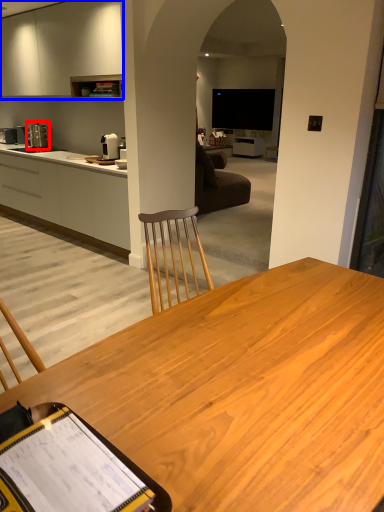
Question: Which of the following is the closest to the observer, coffee machine (highlighted by a red box) or cabinetry (highlighted by a blue box)?

Choices:
 (A) coffee machine
 (B) cabinetry

Answer: (B)